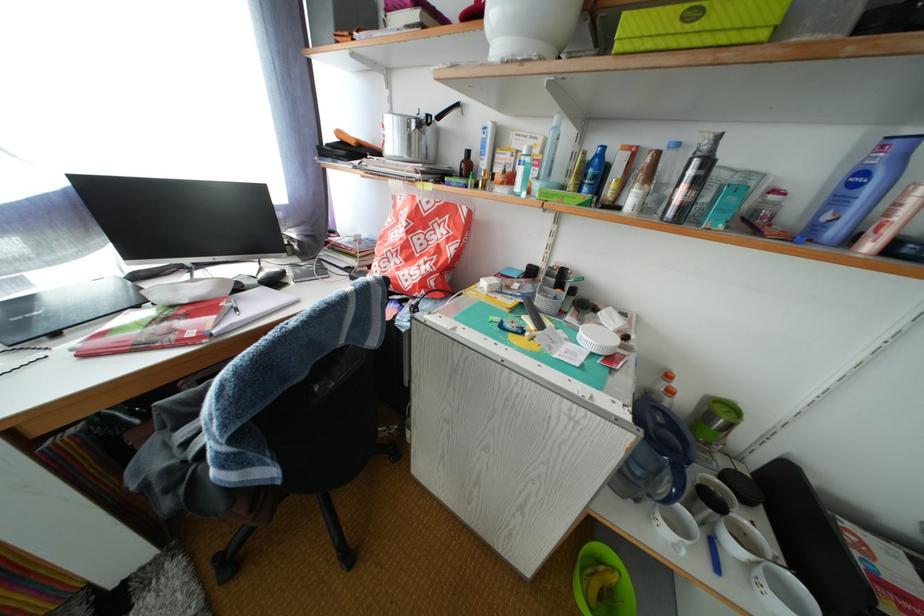
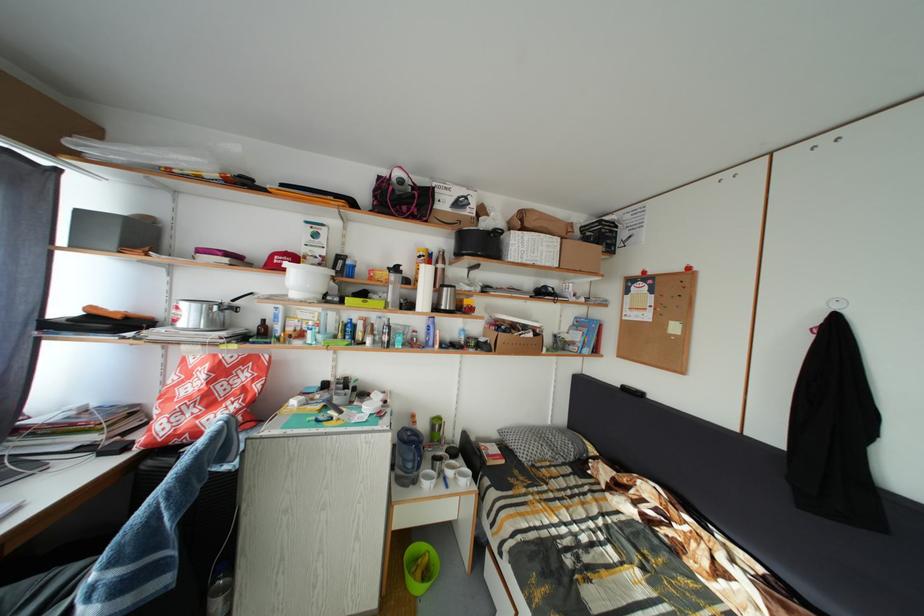
Find the pixel in the second image that matches point (744, 554) in the first image.

(458, 480)